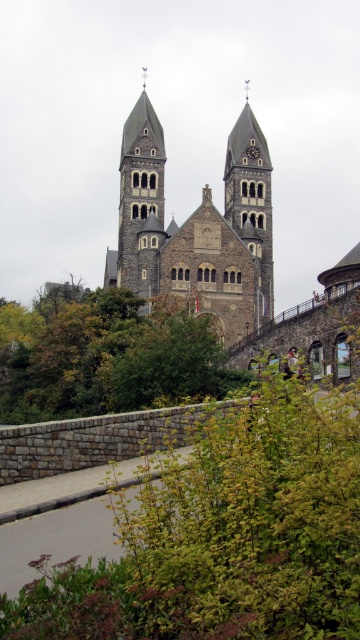
Is smooth stone tower at center closer to the viewer compared to stone tower at center?

Result: That is True.

Is point (118, 276) farther from camera compared to point (250, 214)?

No.

Is point (159, 262) in front of point (272, 298)?

Yes, it is in front of point (272, 298).

You are a GUI agent. You are given a task and a screenshot of the screen. Output one action in this format:
    pyautogui.click(x=<x>, y=<y>)
    Task: Click on the smooth stone tower at center
    
    Given the screenshot: What is the action you would take?
    (x=140, y=202)

Who is positioned more to the left, brown stone church at center or smooth stone tower at center?

Positioned to the left is smooth stone tower at center.

Describe the element at coordinates (196, 227) in the screenshot. I see `brown stone church at center` at that location.

Locate an element on the screen. The height and width of the screenshot is (640, 360). brown stone church at center is located at coordinates point(196,227).

Does green leafy tree at center lie in front of smooth stone tower at center?

Yes, it is in front of smooth stone tower at center.

Can you confirm if green leafy tree at center is positioned above smooth stone tower at center?

Actually, green leafy tree at center is below smooth stone tower at center.

Identify the location of green leafy tree at center. The image size is (360, 640). (111, 358).

I want to click on green leafy tree at center, so click(111, 358).